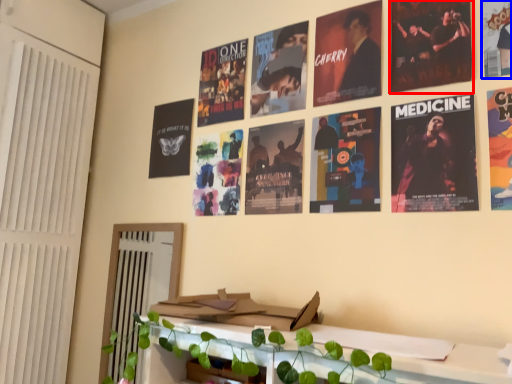
Question: Which object appears closest to the camera in this image, poster (highlighted by a red box) or poster (highlighted by a blue box)?

Choices:
 (A) poster
 (B) poster

Answer: (B)